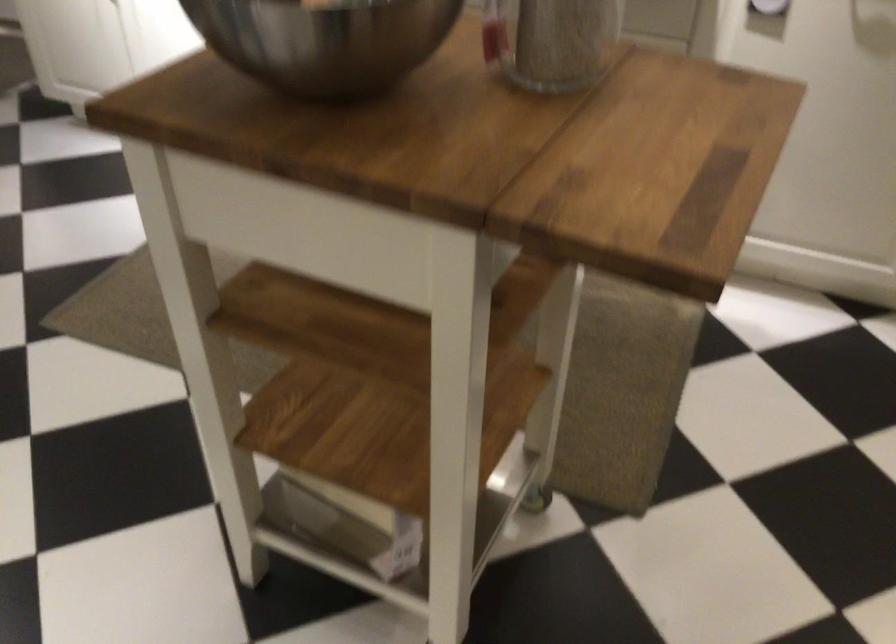
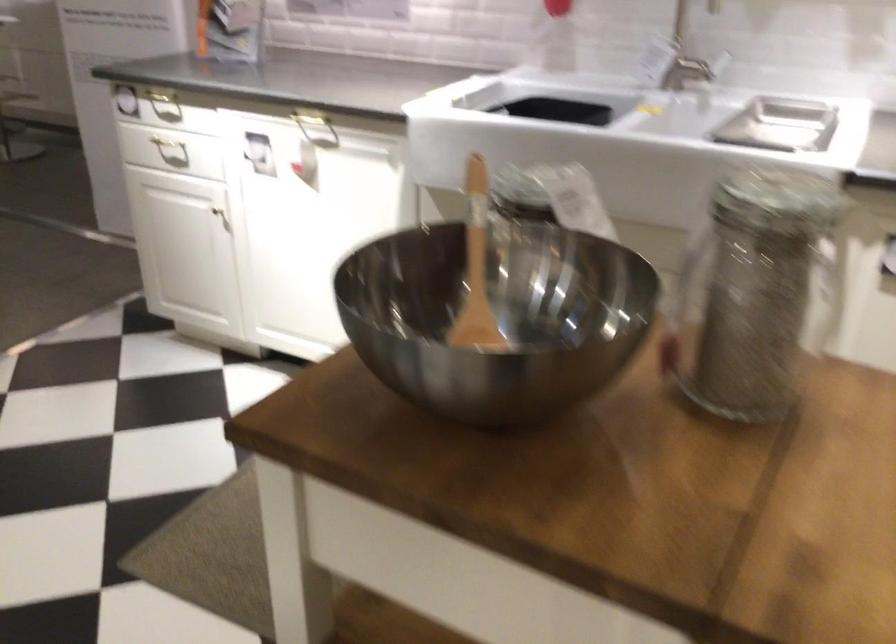
Question: The images are taken continuously from a first-person perspective. In which direction is your viewpoint rotating?

Choices:
 (A) Left
 (B) Right
 (C) Up
 (D) Down

Answer: (C)